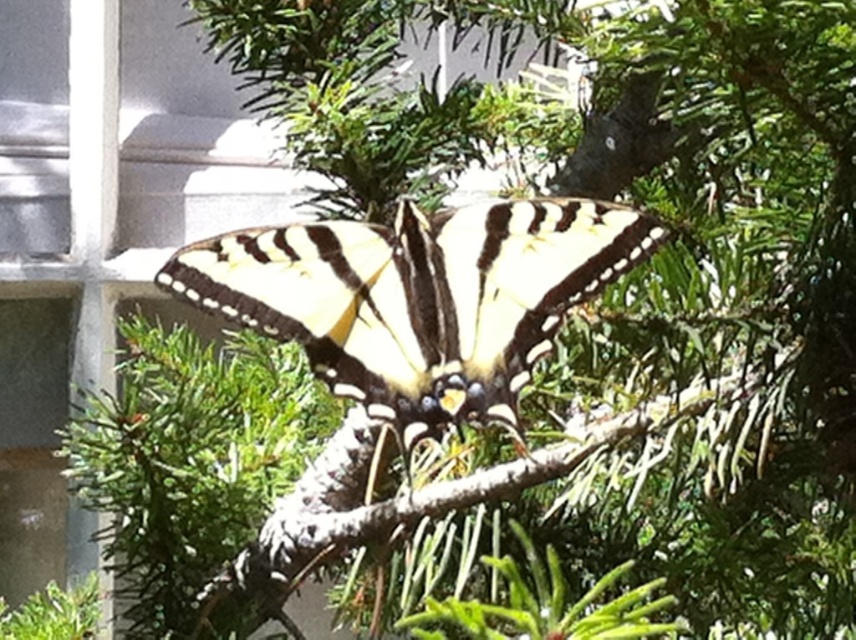
Who is more distant from viewer, (193, 275) or (486, 481)?

The point (486, 481) is more distant.

The width and height of the screenshot is (856, 640). Identify the location of yellow-black-patterned butterfly at center. (419, 298).

Find the location of a particular element. Image resolution: width=856 pixels, height=640 pixels. yellow-black-patterned butterfly at center is located at coordinates (419, 298).